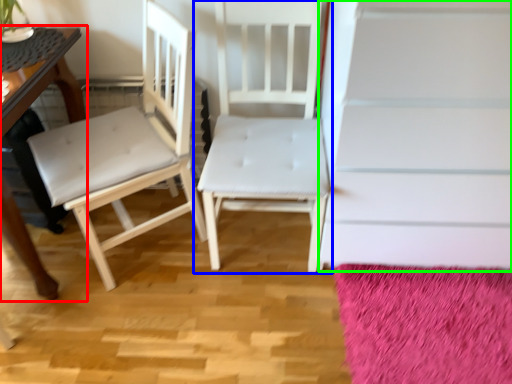
Question: Estimate the real-world distances between objects in this image. Which object is closer to table (highlighted by a red box), chair (highlighted by a blue box) or stairwell (highlighted by a green box)?

Choices:
 (A) chair
 (B) stairwell

Answer: (A)